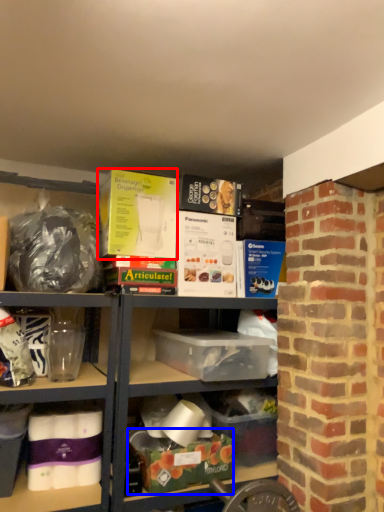
Question: Which point is further to the camera, box (highlighted by a red box) or box (highlighted by a blue box)?

Choices:
 (A) box
 (B) box

Answer: (A)